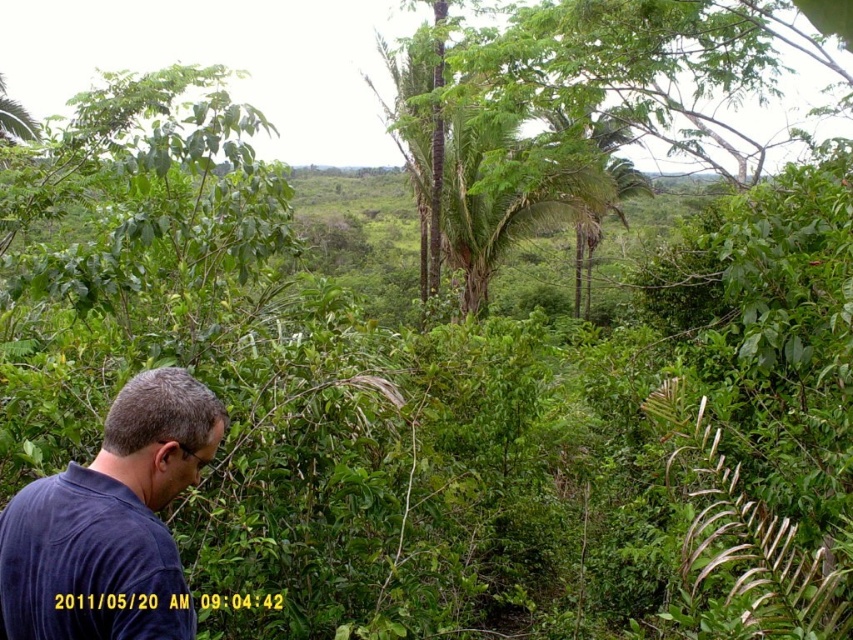
Question: Is green leafy tree at center thinner than dark blue shirt at lower left?

Choices:
 (A) yes
 (B) no

Answer: (B)

Question: Does green leafy tree at center have a lesser width compared to dark blue shirt at lower left?

Choices:
 (A) no
 (B) yes

Answer: (A)

Question: Which of the following is the closest to the observer?

Choices:
 (A) (511, 51)
 (B) (57, 540)

Answer: (B)

Question: Which of the following is the closest to the observer?

Choices:
 (A) dark blue shirt at lower left
 (B) green leafy tree at center

Answer: (A)

Question: Where is green leafy tree at center located in relation to dark blue shirt at lower left in the image?

Choices:
 (A) right
 (B) left

Answer: (A)